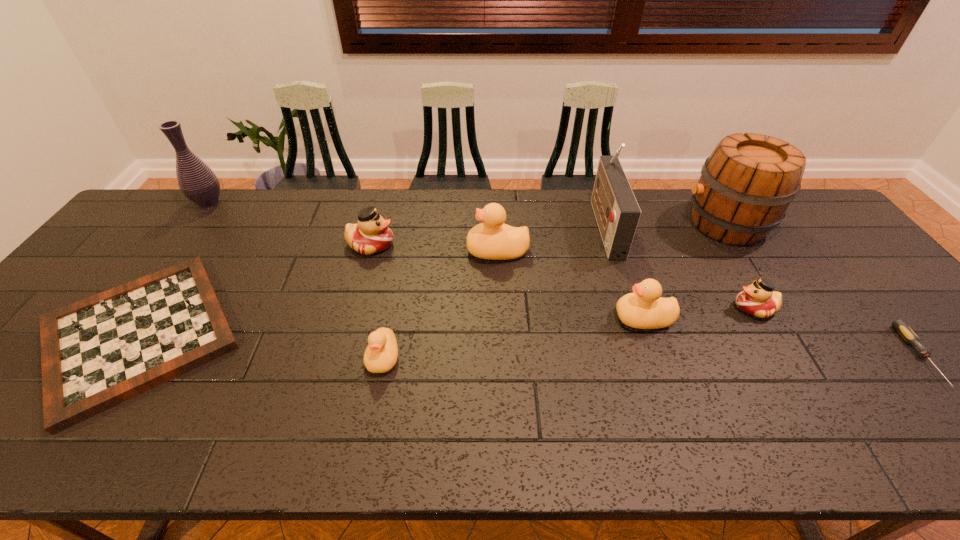
This screenshot has height=540, width=960. In the image, there is a desktop. Find the location of `vacant space at the far edge`. vacant space at the far edge is located at coordinates click(467, 220).

In the image, there is a desktop. At what (x,y) coordinates should I click in order to perform the action: click on vacant space at the near edge. Please return your answer as a coordinate pair (x, y). Image resolution: width=960 pixels, height=540 pixels. Looking at the image, I should click on (644, 418).

This screenshot has height=540, width=960. Find the location of `vacant region at the right edge of the desktop`. vacant region at the right edge of the desktop is located at coordinates (857, 295).

Where is `vacant space in between the nearer red duck and the nearest duck`? vacant space in between the nearer red duck and the nearest duck is located at coordinates (568, 333).

Locate an element on the screen. empty location between the screwdriver and the cider is located at coordinates (823, 290).

The image size is (960, 540). Find the location of `vacant area between the shortest object and the vase`. vacant area between the shortest object and the vase is located at coordinates (564, 279).

Locate an element on the screen. The width and height of the screenshot is (960, 540). free space that is in between the farther red duck and the cider is located at coordinates (548, 234).

At what (x,y) coordinates should I click in order to perform the action: click on vacant region between the fourth duck from left to right and the bigger red duck. Please return your answer as a coordinate pair (x, y). Image resolution: width=960 pixels, height=540 pixels. Looking at the image, I should click on (507, 281).

Identify the location of vacant space in between the second duck from right to left and the farther red duck. This screenshot has width=960, height=540. (507, 281).

I want to click on free space between the screwdriver and the vase, so click(564, 279).